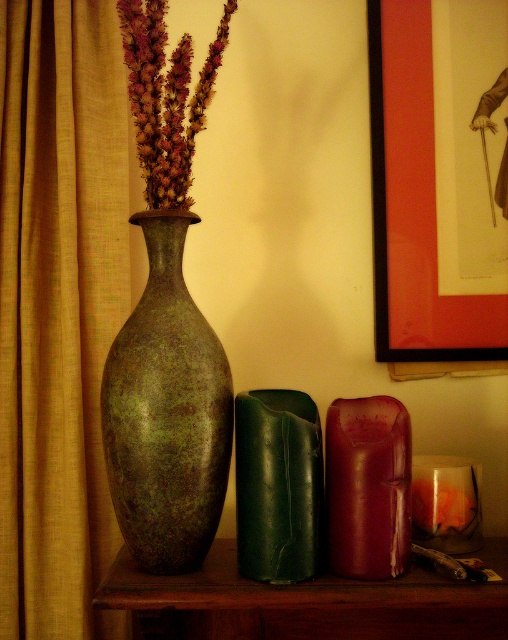
Question: Is green patina vase at center to the left of green matte vase at center from the viewer's perspective?

Choices:
 (A) yes
 (B) no

Answer: (A)

Question: Which object is positioned farthest from the purple textured flowers at center?

Choices:
 (A) gold textured curtain at left
 (B) leather-like red at center
 (C) green patina vase at center
 (D) wooden shelf at center

Answer: (D)

Question: Which point is closer to the camera?

Choices:
 (A) (12, 320)
 (B) (157, 616)

Answer: (B)

Question: Is matte red picture frame at upper right positioned in front of leather-like red at center?

Choices:
 (A) no
 (B) yes

Answer: (A)

Question: Is matte red picture frame at upper right closer to camera compared to leather-like red at center?

Choices:
 (A) no
 (B) yes

Answer: (A)

Question: Which object appears farthest from the camera in this image?

Choices:
 (A) leather-like red at center
 (B) green matte vase at center
 (C) green patina vase at center
 (D) matte red picture frame at upper right

Answer: (D)